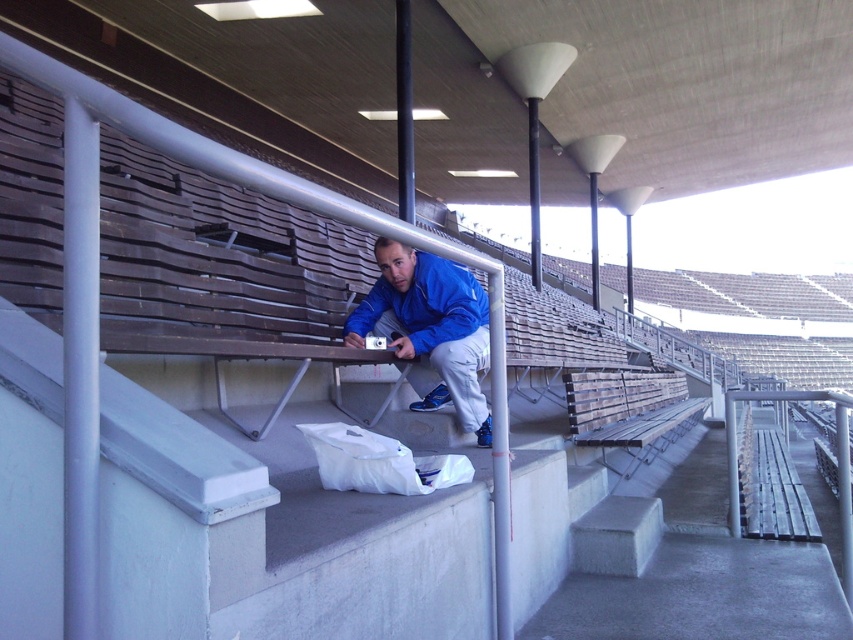
Question: In this image, where is blue fabric jacket at center located relative to wooden bench at center?

Choices:
 (A) right
 (B) left

Answer: (B)

Question: Observing the image, what is the correct spatial positioning of blue fabric jacket at center in reference to wooden bench at center?

Choices:
 (A) above
 (B) below

Answer: (A)

Question: Can you confirm if blue fabric jacket at center is positioned to the right of wooden bench at center?

Choices:
 (A) yes
 (B) no

Answer: (B)

Question: Which point appears closest to the camera in this image?

Choices:
 (A) (677, 385)
 (B) (471, 422)

Answer: (B)